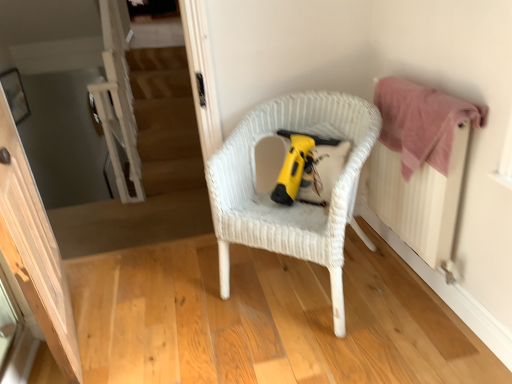
The height and width of the screenshot is (384, 512). What do you see at coordinates (295, 203) in the screenshot?
I see `white wicker chair at center` at bounding box center [295, 203].

Describe the element at coordinates (422, 122) in the screenshot. I see `pink cotton towel at upper right` at that location.

I want to click on transparent glass screen door at left, so click(34, 249).

The height and width of the screenshot is (384, 512). What do you see at coordinates (295, 164) in the screenshot?
I see `yellow plastic vacuum cleaner at center` at bounding box center [295, 164].

What do you see at coordinates (418, 198) in the screenshot? The image size is (512, 384). I see `pink fabric radiator at right` at bounding box center [418, 198].

This screenshot has width=512, height=384. In order to click on wooden floor at center in this screenshot , I will do `click(267, 319)`.

At what (x,y) coordinates should I click in order to perform the action: click on white wicker chair at center. Please return your answer as a coordinate pair (x, y). This screenshot has height=384, width=512. Looking at the image, I should click on (295, 203).

Is pink fabric radiator at right oriented away from wooden floor at center?

pink fabric radiator at right does not have its back to wooden floor at center.

Considering the sizes of objects pink fabric radiator at right and wooden floor at center in the image provided, who is thinner, pink fabric radiator at right or wooden floor at center?

Thinner between the two is pink fabric radiator at right.

Considering the points (415, 194) and (191, 275), which point is behind, point (415, 194) or point (191, 275)?

Positioned behind is point (191, 275).

Is pink fabric radiator at right far from wooden floor at center?

No, pink fabric radiator at right is not far away from wooden floor at center.

Can you confirm if white wicker chair at center is wider than pink cotton towel at upper right?

Correct, the width of white wicker chair at center exceeds that of pink cotton towel at upper right.

Is white wicker chair at center far away from pink cotton towel at upper right?

white wicker chair at center is near pink cotton towel at upper right, not far away.

Is pink cotton towel at upper right located within white wicker chair at center?

No, pink cotton towel at upper right is located outside of white wicker chair at center.

Can you confirm if white wicker chair at center is taller than pink cotton towel at upper right?

Correct, white wicker chair at center is much taller as pink cotton towel at upper right.

From the picture: Is yellow plastic vacuum cleaner at center aimed at transparent glass screen door at left?

No, yellow plastic vacuum cleaner at center is not facing towards transparent glass screen door at left.

From the picture: Considering the sizes of yellow plastic vacuum cleaner at center and transparent glass screen door at left in the image, is yellow plastic vacuum cleaner at center bigger or smaller than transparent glass screen door at left?

Clearly, yellow plastic vacuum cleaner at center is smaller in size than transparent glass screen door at left.

Which object is further away from the camera taking this photo, yellow plastic vacuum cleaner at center or transparent glass screen door at left?

yellow plastic vacuum cleaner at center is further from the camera.

Is wooden floor at center further to the viewer compared to white wicker chair at center?

No.

Does wooden floor at center have a smaller size compared to white wicker chair at center?

Yes.

How distant is wooden floor at center from white wicker chair at center?

wooden floor at center is 15.46 inches from white wicker chair at center.

Considering the sizes of wooden floor at center and white wicker chair at center in the image, is wooden floor at center taller or shorter than white wicker chair at center?

Clearly, wooden floor at center is shorter compared to white wicker chair at center.

Is point (268, 266) farther from viewer compared to point (8, 139)?

Yes.

Is wooden floor at center thinner than transparent glass screen door at left?

No, wooden floor at center is not thinner than transparent glass screen door at left.

Which is more to the left, wooden floor at center or transparent glass screen door at left?

Positioned to the left is transparent glass screen door at left.

From the picture: Considering the sizes of objects wooden floor at center and transparent glass screen door at left in the image provided, who is taller, wooden floor at center or transparent glass screen door at left?

With more height is transparent glass screen door at left.

Consider the image. Is pink fabric radiator at right wider than transparent glass screen door at left?

No.

From the image's perspective, is pink fabric radiator at right on top of transparent glass screen door at left?

Yes, from the image's perspective, pink fabric radiator at right is over transparent glass screen door at left.

Is pink fabric radiator at right inside or outside of transparent glass screen door at left?

pink fabric radiator at right is located beyond the bounds of transparent glass screen door at left.

Who is more distant, pink fabric radiator at right or transparent glass screen door at left?

pink fabric radiator at right.

Considering the relative sizes of yellow plastic vacuum cleaner at center and white wicker chair at center in the image provided, is yellow plastic vacuum cleaner at center thinner than white wicker chair at center?

Correct, the width of yellow plastic vacuum cleaner at center is less than that of white wicker chair at center.

Looking at the image, does yellow plastic vacuum cleaner at center seem bigger or smaller compared to white wicker chair at center?

In the image, yellow plastic vacuum cleaner at center appears to be smaller than white wicker chair at center.

From a real-world perspective, is yellow plastic vacuum cleaner at center located higher than white wicker chair at center?

Yes, from a real-world perspective, yellow plastic vacuum cleaner at center is above white wicker chair at center.

Is yellow plastic vacuum cleaner at center oriented towards white wicker chair at center?

Yes, yellow plastic vacuum cleaner at center is aimed at white wicker chair at center.

The image size is (512, 384). In order to click on radiator on the right of wooden floor at center in this screenshot , I will do `click(418, 198)`.

This screenshot has height=384, width=512. I want to click on clothe behind the white wicker chair at center, so click(x=422, y=122).

Considering their positions, is wooden floor at center positioned further to pink fabric radiator at right than pink cotton towel at upper right?

wooden floor at center is positioned further to the anchor pink fabric radiator at right.

Which object lies further to the anchor point transparent glass screen door at left, wooden floor at center or yellow plastic vacuum cleaner at center?

yellow plastic vacuum cleaner at center is further to transparent glass screen door at left.

Consider the image. Based on their spatial positions, is transparent glass screen door at left or yellow plastic vacuum cleaner at center closer to wooden floor at center?

The object closer to wooden floor at center is transparent glass screen door at left.

When comparing their distances from transparent glass screen door at left, does wooden floor at center or white wicker chair at center seem closer?

Based on the image, wooden floor at center appears to be nearer to transparent glass screen door at left.

Which object lies nearer to the anchor point yellow plastic vacuum cleaner at center, pink cotton towel at upper right or pink fabric radiator at right?

pink cotton towel at upper right lies closer to yellow plastic vacuum cleaner at center than the other object.

Considering their positions, is pink fabric radiator at right positioned further to white wicker chair at center than pink cotton towel at upper right?

Based on the image, pink fabric radiator at right appears to be further to white wicker chair at center.

Estimate the real-world distances between objects in this image. Which object is further from pink fabric radiator at right, yellow plastic vacuum cleaner at center or wooden floor at center?

The object further to pink fabric radiator at right is wooden floor at center.

In the scene shown: Considering their positions, is wooden floor at center positioned closer to pink cotton towel at upper right than transparent glass screen door at left?

wooden floor at center lies closer to pink cotton towel at upper right than the other object.

The width and height of the screenshot is (512, 384). What are the coordinates of `clothe situated between wooden floor at center and pink fabric radiator at right from left to right` in the screenshot? It's located at (422, 122).

Where is `clothe positioned between white wicker chair at center and yellow plastic vacuum cleaner at center from near to far`? This screenshot has height=384, width=512. clothe positioned between white wicker chair at center and yellow plastic vacuum cleaner at center from near to far is located at coordinates 422,122.

At what (x,y) coordinates should I click in order to perform the action: click on equipment between wooden floor at center and pink fabric radiator at right from left to right. Please return your answer as a coordinate pair (x, y). Looking at the image, I should click on (295, 164).

I want to click on wood situated between transparent glass screen door at left and white wicker chair at center from left to right, so click(x=267, y=319).